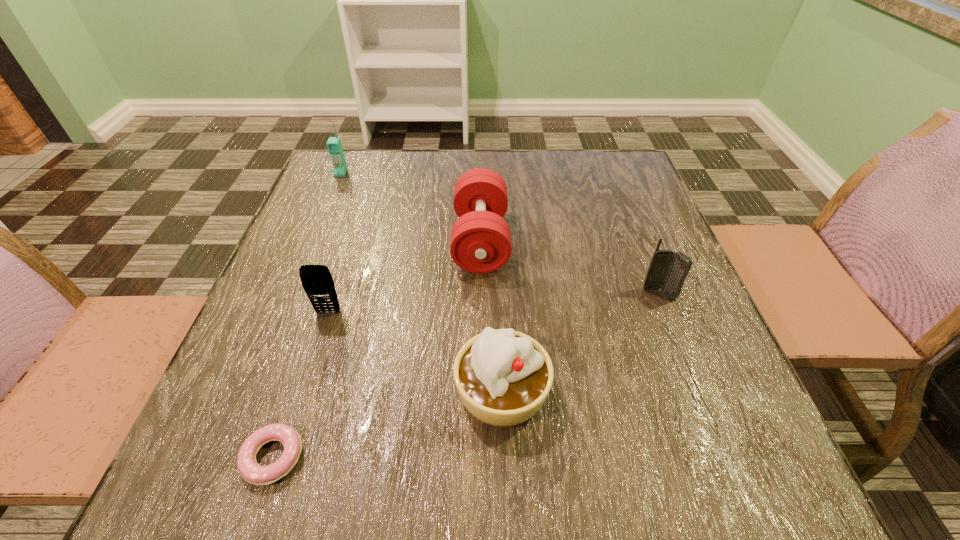
Locate an element on the screen. The image size is (960, 540). vacant space that is in between the second cellular telephone from left to right and the leftmost cellular telephone is located at coordinates (334, 243).

Image resolution: width=960 pixels, height=540 pixels. I want to click on free space between the whipped cream and the farthest object, so click(x=421, y=282).

Find the location of a particular element. This screenshot has height=540, width=960. vacant area that lies between the doughnut and the nearest cellular telephone is located at coordinates (300, 385).

Find the location of a particular element. The height and width of the screenshot is (540, 960). free space between the nearest cellular telephone and the second farthest object is located at coordinates (404, 276).

Identify the location of empty location between the third nearest object and the dumbbell. (x=404, y=276).

In order to click on vacant space that's between the dumbbell and the nearest cellular telephone in this screenshot , I will do `click(404, 276)`.

Image resolution: width=960 pixels, height=540 pixels. Identify the location of object that is the third closest to the fourth farthest object. (503, 377).

Locate an element on the screen. the second closest object to the fifth nearest object is located at coordinates (317, 281).

Find the location of a particular element. cellular telephone that stands as the second closest to the leftmost cellular telephone is located at coordinates (667, 270).

Where is `cellular telephone that is the closest to the farthest object`? cellular telephone that is the closest to the farthest object is located at coordinates (317, 281).